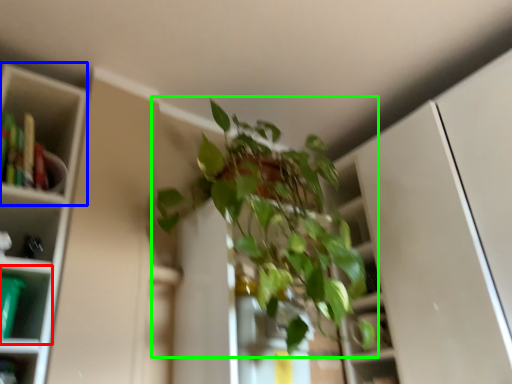
Question: Based on their relative distances, which object is nearer to shelf (highlighted by a red box)? Choose from cabinet (highlighted by a blue box) and houseplant (highlighted by a green box).

Choices:
 (A) cabinet
 (B) houseplant

Answer: (A)